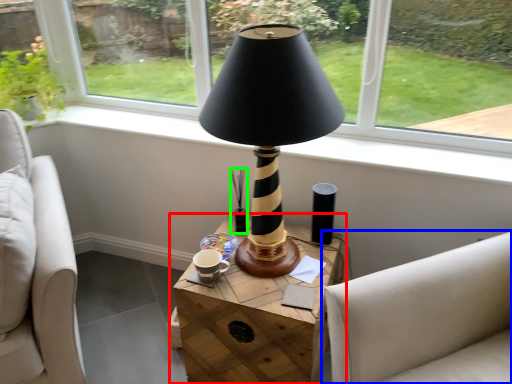
Question: Which object is positioned farthest from table (highlighted by a red box)? Select from studio couch (highlighted by a blue box) and candle holder (highlighted by a green box).

Choices:
 (A) studio couch
 (B) candle holder

Answer: (B)